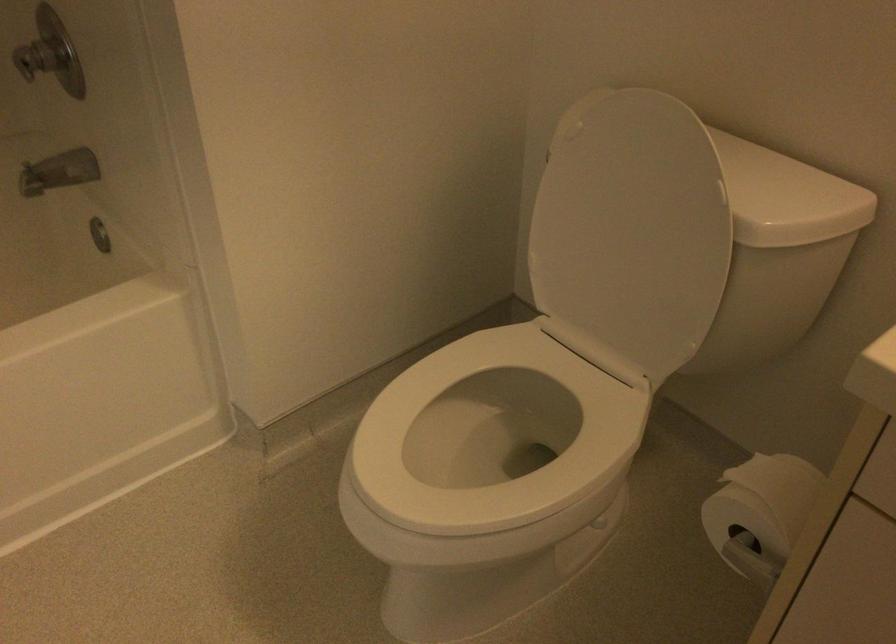
The width and height of the screenshot is (896, 644). What do you see at coordinates (488, 450) in the screenshot?
I see `a white toilet seat` at bounding box center [488, 450].